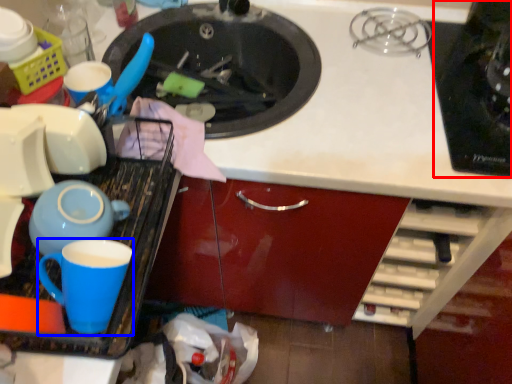
Question: Which object appears farthest to the camera in this image, appliance (highlighted by a red box) or coffee cup (highlighted by a blue box)?

Choices:
 (A) appliance
 (B) coffee cup

Answer: (A)